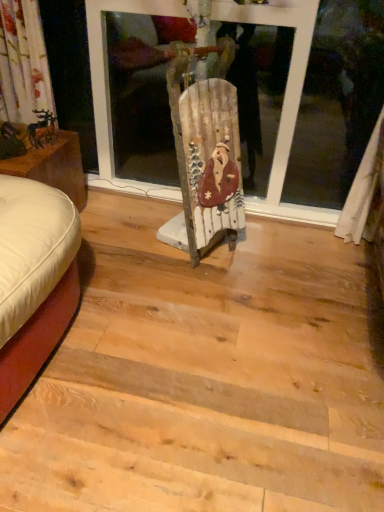
Locate an element on the screen. The image size is (384, 512). vacant space to the left of metallic gold reindeer at left is located at coordinates (20, 136).